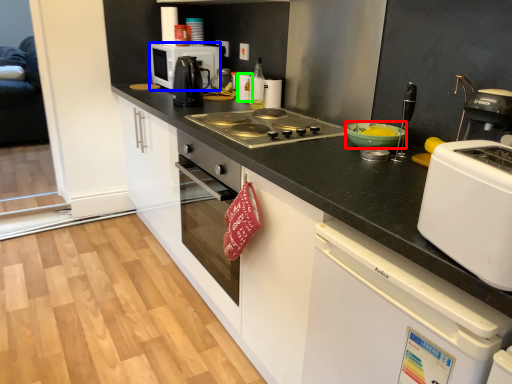
Question: Considering the real-world distances, which object is farthest from bowl (highlighted by a red box)? kitchen appliance (highlighted by a blue box) or kitchen appliance (highlighted by a green box)?

Choices:
 (A) kitchen appliance
 (B) kitchen appliance

Answer: (A)